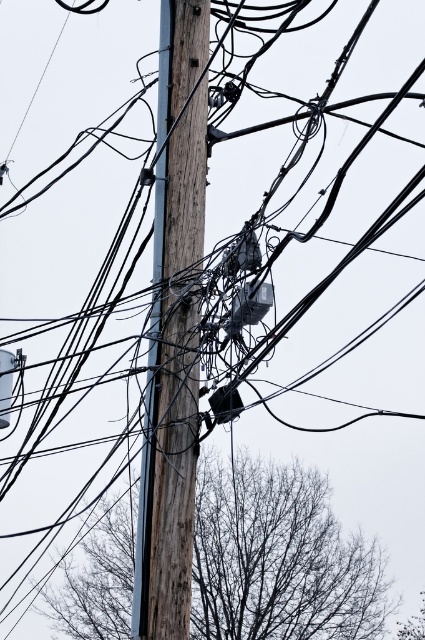
Question: Is bare branches at lower center to the left of wooden telegraph pole at center from the viewer's perspective?

Choices:
 (A) yes
 (B) no

Answer: (A)

Question: Which point is closer to the camera taking this photo?

Choices:
 (A) (368, 609)
 (B) (198, 369)

Answer: (B)

Question: Can you confirm if bare branches at lower center is positioned above wooden telegraph pole at center?

Choices:
 (A) no
 (B) yes

Answer: (A)

Question: Which of the following is the closest to the observer?

Choices:
 (A) wooden telegraph pole at center
 (B) bare branches at lower center

Answer: (A)

Question: Is bare branches at lower center to the right of wooden telegraph pole at center from the viewer's perspective?

Choices:
 (A) yes
 (B) no

Answer: (B)